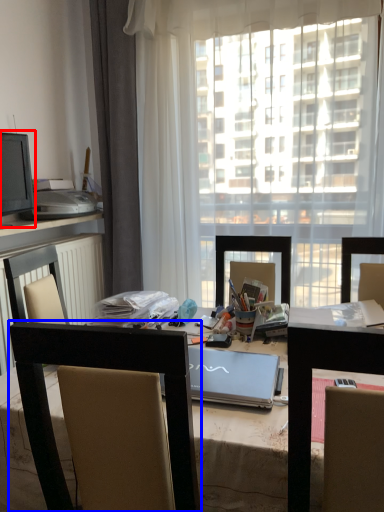
Question: Which of the following is the closest to the observer, computer monitor (highlighted by a red box) or chair (highlighted by a blue box)?

Choices:
 (A) computer monitor
 (B) chair

Answer: (B)